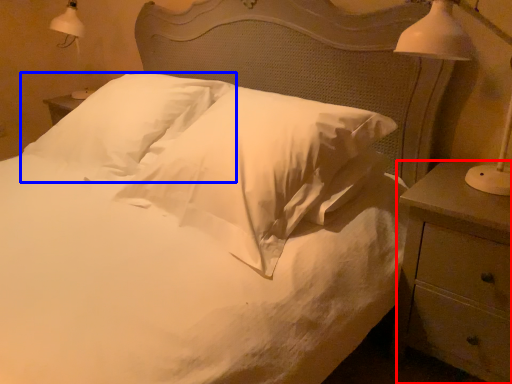
Question: Which object is further to the camera taking this photo, nightstand (highlighted by a red box) or pillow (highlighted by a blue box)?

Choices:
 (A) nightstand
 (B) pillow

Answer: (B)